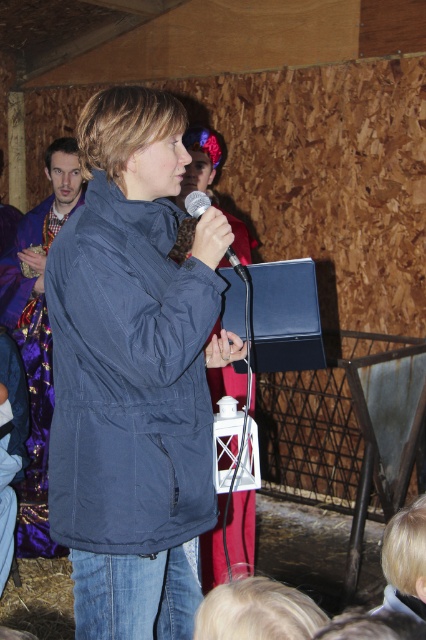
Question: Among these objects, which one is farthest from the camera?

Choices:
 (A) navy blue jacket at center
 (B) black matte microphone at center
 (C) purple sequined robe at left

Answer: (C)

Question: Can you confirm if navy blue jacket at center is positioned above black matte microphone at center?

Choices:
 (A) no
 (B) yes

Answer: (A)

Question: Does navy blue jacket at center have a smaller size compared to black matte microphone at center?

Choices:
 (A) no
 (B) yes

Answer: (A)

Question: From the image, what is the correct spatial relationship of purple sequined robe at left in relation to black matte microphone at center?

Choices:
 (A) above
 (B) below

Answer: (B)

Question: Among these objects, which one is nearest to the camera?

Choices:
 (A) black matte microphone at center
 (B) purple sequined robe at left

Answer: (A)

Question: Considering the real-world distances, which object is closest to the black matte microphone at center?

Choices:
 (A) navy blue jacket at center
 (B) purple sequined robe at left

Answer: (A)